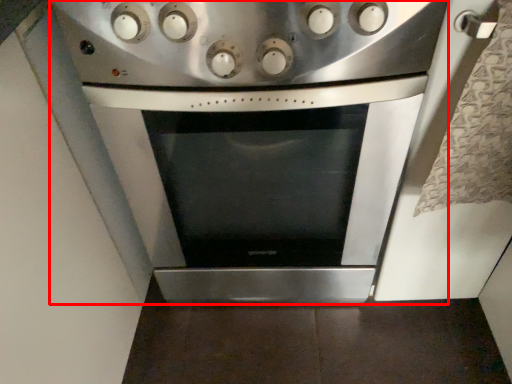
Question: From the image's perspective, what is the correct spatial positioning of kitchen appliance (annotated by the red box) in reference to gas stove?

Choices:
 (A) below
 (B) above

Answer: (A)